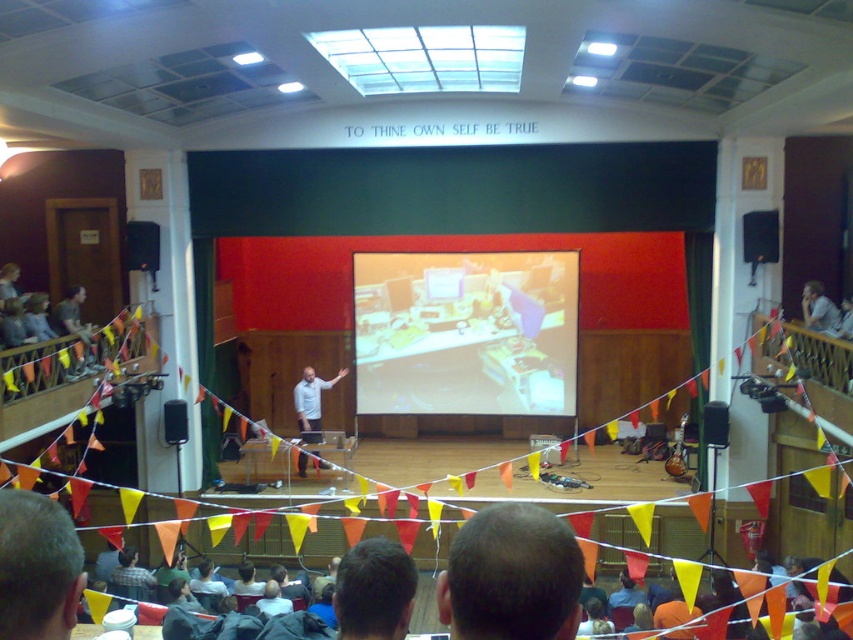
Question: Which is nearer to the black plastic speaker at upper right?

Choices:
 (A) light blue shirt at center
 (B) black plastic speaker at center
 (C) black plastic speaker at left

Answer: (A)

Question: Can you confirm if matte yellow projector screen at center is thinner than light blue shirt at center?

Choices:
 (A) no
 (B) yes

Answer: (A)

Question: Which of these objects is positioned farthest from the matte yellow projector screen at center?

Choices:
 (A) black plastic speaker at left
 (B) black plastic speaker at center
 (C) black plastic speaker at upper right

Answer: (A)

Question: Can you confirm if matte yellow projector screen at center is positioned to the right of black plastic speaker at upper right?

Choices:
 (A) yes
 (B) no

Answer: (B)

Question: Is light blue shirt at center positioned before black plastic speaker at upper right?

Choices:
 (A) no
 (B) yes

Answer: (A)

Question: Estimate the real-world distances between objects in this image. Which object is closer to the matte yellow projector screen at center?

Choices:
 (A) light blue shirt at center
 (B) black plastic speaker at center

Answer: (A)